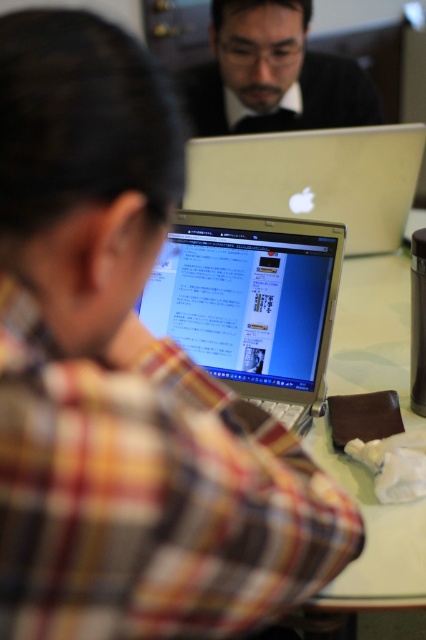
Question: Which point is closer to the camera?

Choices:
 (A) matte black laptop at upper center
 (B) silver metallic laptop at center
 (C) silver metallic laptop at upper center

Answer: (B)

Question: Which object is closer to the camera taking this photo?

Choices:
 (A) silver metallic laptop at upper center
 (B) matte black laptop at upper center
 (C) silver metallic laptop at center

Answer: (C)

Question: Is silver metallic laptop at center below matte black laptop at upper center?

Choices:
 (A) yes
 (B) no

Answer: (A)

Question: Can you confirm if silver metallic laptop at upper center is bigger than matte black laptop at upper center?

Choices:
 (A) no
 (B) yes

Answer: (B)

Question: Which point appears farthest from the camera in this image?

Choices:
 (A) (204, 196)
 (B) (265, 74)
 (C) (321, 228)

Answer: (B)

Question: Is silver metallic laptop at center positioned in front of silver metallic laptop at upper center?

Choices:
 (A) no
 (B) yes

Answer: (B)